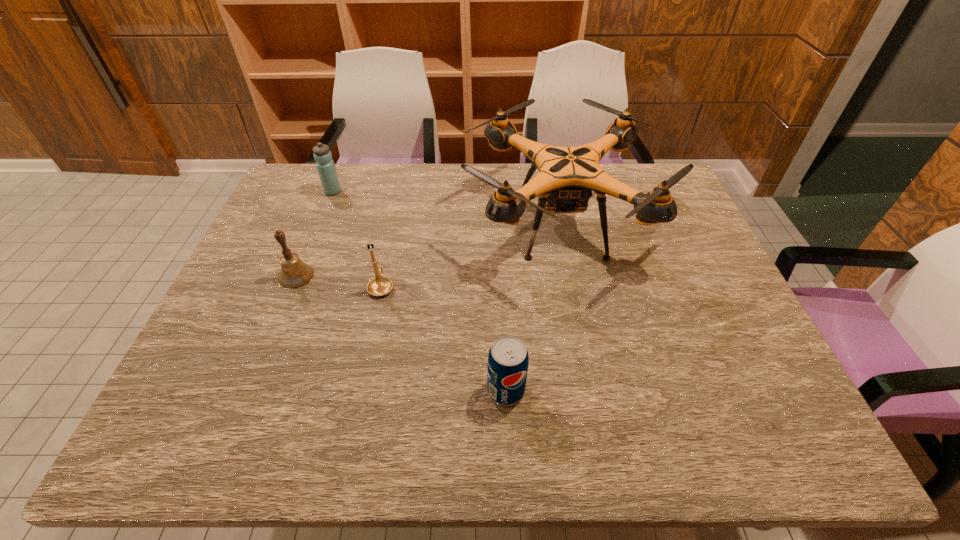
The width and height of the screenshot is (960, 540). I want to click on free space between the water bottle and the candle holder, so (x=357, y=239).

Find the location of a particular element. unoccupied position between the nearest object and the tallest object is located at coordinates (533, 307).

Locate an element on the screen. vacant region between the nearest object and the bell is located at coordinates (401, 333).

This screenshot has height=540, width=960. In order to click on free space between the third object from left to right and the pop in this screenshot , I will do `click(444, 339)`.

Locate an element on the screen. Image resolution: width=960 pixels, height=540 pixels. free space between the bell and the water bottle is located at coordinates (315, 234).

Where is `vacant area between the water bottle and the nearest object`? vacant area between the water bottle and the nearest object is located at coordinates (420, 291).

The width and height of the screenshot is (960, 540). Find the location of `the closest object to the bell`. the closest object to the bell is located at coordinates (379, 286).

Identify which object is the third nearest to the nearest object. Please provide its 2D coordinates. Your answer should be formatted as a tuple, i.e. [(x, y)], where the tuple contains the x and y coordinates of a point satisfying the conditions above.

[(294, 273)]

Where is `vacant space that satisfies the following two spatial constraints: 1. on the camera mount of the tallest object; 2. on the front side of the pop`? vacant space that satisfies the following two spatial constraints: 1. on the camera mount of the tallest object; 2. on the front side of the pop is located at coordinates (593, 390).

You are a GUI agent. You are given a task and a screenshot of the screen. Output one action in this format:
    pyautogui.click(x=<x>, y=<y>)
    Task: Click on the free spot that satisfies the following two spatial constraints: 1. on the back side of the bell; 2. on the left side of the water bottle
    The width and height of the screenshot is (960, 540).
    Given the screenshot: What is the action you would take?
    pyautogui.click(x=330, y=192)